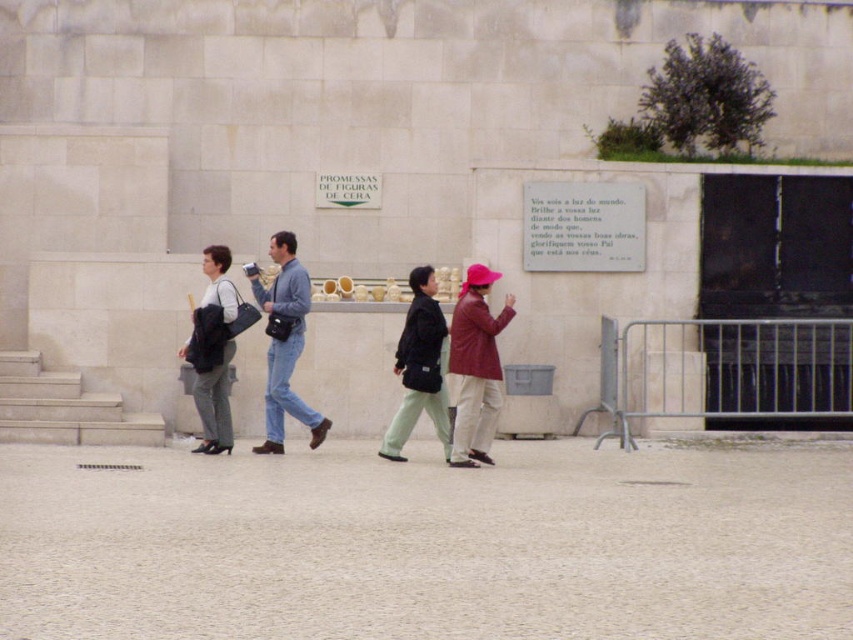
Between point (410, 394) and point (213, 268), which one is positioned in front?

Point (410, 394)

Is matte black jacket at center to the right of matte black bag at left from the viewer's perspective?

Indeed, matte black jacket at center is positioned on the right side of matte black bag at left.

Does point (422, 401) come farther from viewer compared to point (212, 445)?

That is False.

Where is `matte black jacket at center`? The height and width of the screenshot is (640, 853). matte black jacket at center is located at coordinates (419, 368).

Does denim jeans at center come behind matte black jacket at center?

Yes, denim jeans at center is behind matte black jacket at center.

Based on the photo, who is positioned more to the right, denim jeans at center or matte black jacket at center?

Positioned to the right is matte black jacket at center.

Between point (273, 369) and point (416, 280), which one is positioned behind?

The point (273, 369) is behind.

At what (x,y) coordinates should I click in order to perform the action: click on denim jeans at center. Please return your answer as a coordinate pair (x, y). Looking at the image, I should click on (283, 342).

Is point (480, 307) farther from camera compared to point (204, 252)?

No.

Does matte pink hat at center have a smaller size compared to matte black bag at left?

Indeed, matte pink hat at center has a smaller size compared to matte black bag at left.

Is point (471, 272) behind point (210, 259)?

No, it is in front of (210, 259).

The image size is (853, 640). Identify the location of matte pink hat at center. (474, 365).